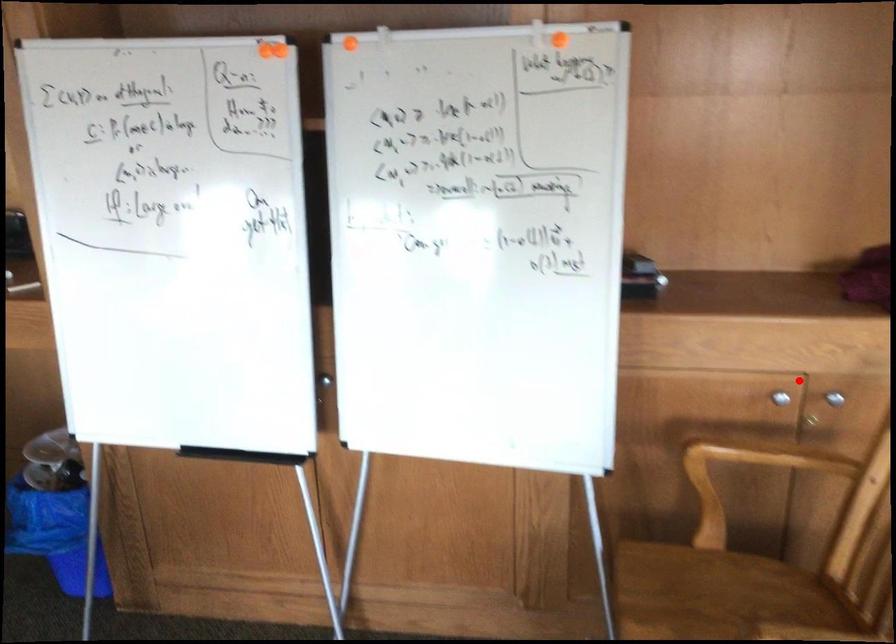
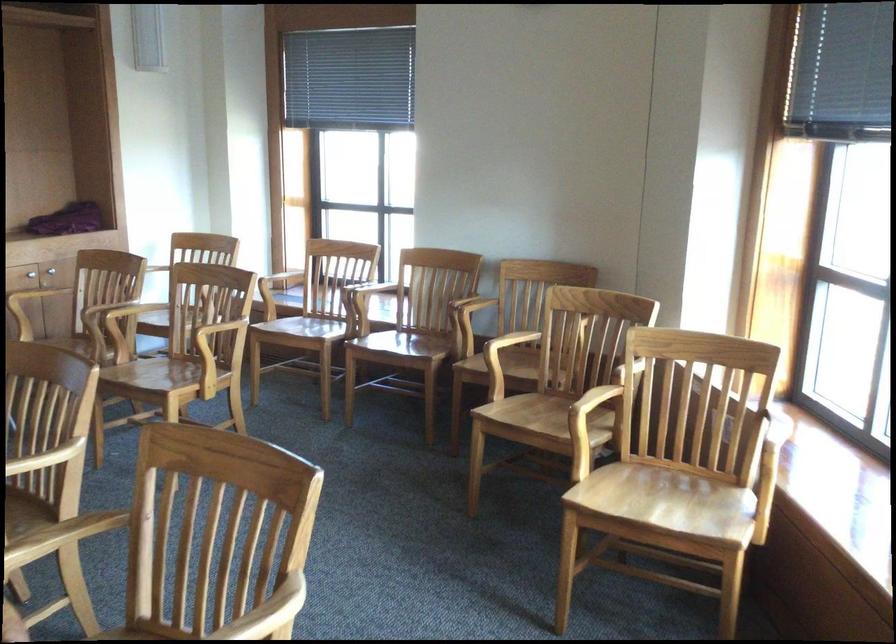
In the second image, find the point that corresponds to the highlighted location in the first image.

(31, 272)